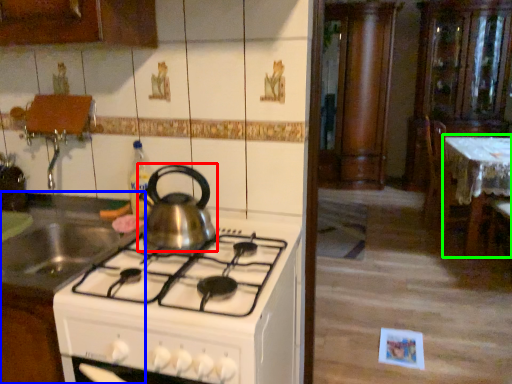
Question: Which object is positioned closest to kitchen appliance (highlighted by a red box)? Select from kitchen appliance (highlighted by a blue box) and table (highlighted by a green box).

Choices:
 (A) kitchen appliance
 (B) table

Answer: (A)